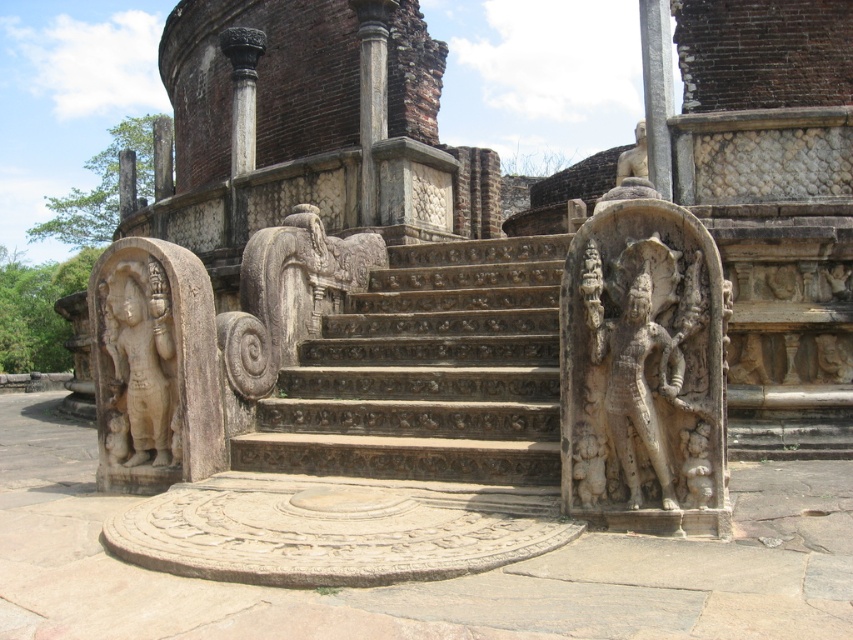
Question: Which point appears farthest from the camera in this image?

Choices:
 (A) (345, 436)
 (B) (635, 154)

Answer: (B)

Question: Does carved stone stairs at center lie in front of beige stone statue at left?

Choices:
 (A) yes
 (B) no

Answer: (B)

Question: Which point is closer to the camera taking this photo?

Choices:
 (A) [x=437, y=364]
 (B) [x=366, y=54]
 (C) [x=144, y=369]

Answer: (C)

Question: Is carved stone stairs at center wider than beige stone statue at left?

Choices:
 (A) no
 (B) yes

Answer: (A)

Question: Can you confirm if stone statues at center is positioned below carved stone stairs at center?

Choices:
 (A) no
 (B) yes

Answer: (A)

Question: Which object is closer to the camera taking this photo?

Choices:
 (A) beige stone statue at left
 (B) stone statues at center
 (C) carved stone stairs at center

Answer: (B)